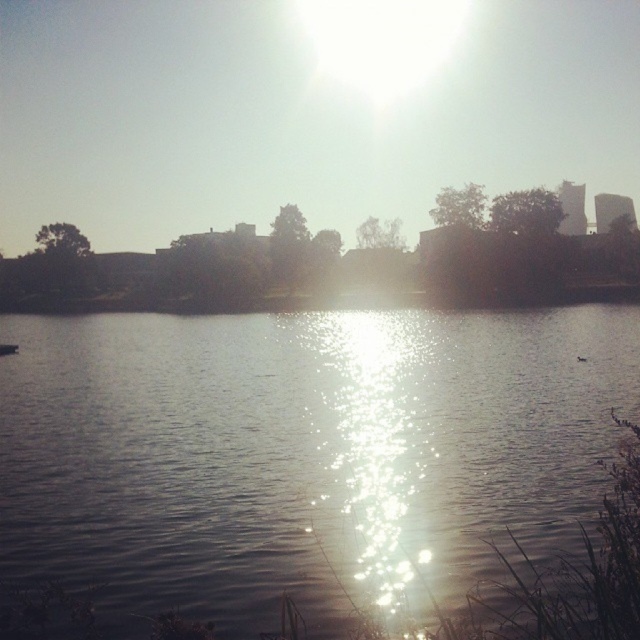
Who is more forward, (316, 348) or (404, 540)?

Positioned in front is point (404, 540).

Does silvery reflective water at center appear over sparkling water at center?

Yes.

Is point (481, 413) farther from camera compared to point (353, 356)?

No, it is in front of (353, 356).

The height and width of the screenshot is (640, 640). I want to click on silvery reflective water at center, so click(x=300, y=452).